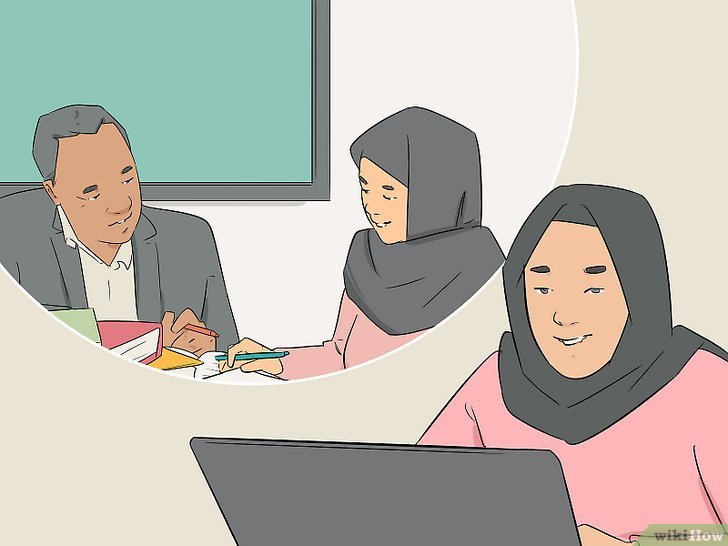
This screenshot has height=546, width=728. Identify the location of gray laptop. (379, 494).